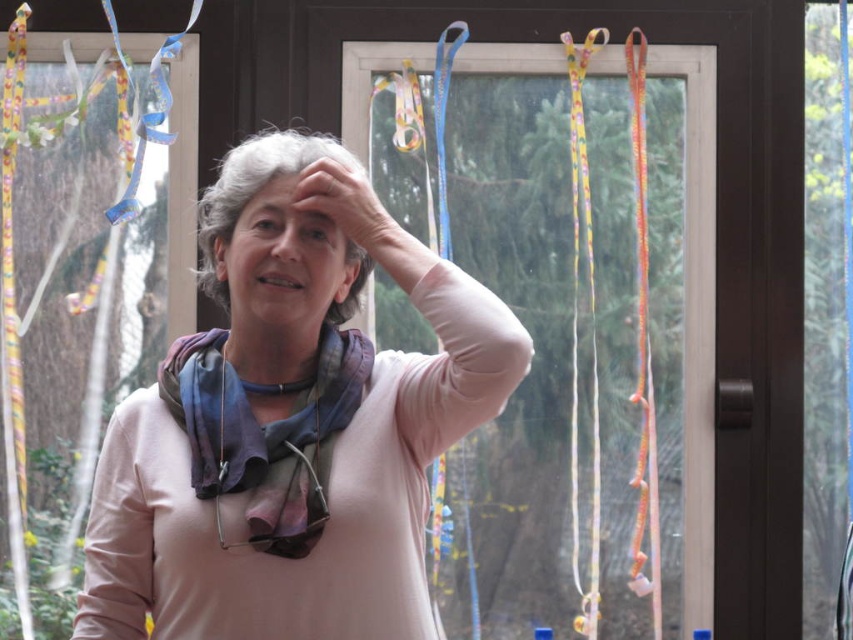
Between point (704, 388) and point (297, 141), which one is positioned behind?

Positioned behind is point (704, 388).

Between point (697, 563) and point (251, 156), which one is positioned behind?

The point (697, 563) is behind.

Locate an element on the screen. This screenshot has height=640, width=853. transparent plastic ribbons at upper center is located at coordinates (695, 316).

Between pink fabric scarf at center and smooth skin at center, which one is positioned higher?

smooth skin at center is higher up.

Can you confirm if pink fabric scarf at center is positioned to the left of smooth skin at center?

Incorrect, pink fabric scarf at center is not on the left side of smooth skin at center.

Who is more forward, (317,348) or (256,204)?

Positioned in front is point (256,204).

This screenshot has width=853, height=640. Identify the location of pink fabric scarf at center. (289, 433).

Is multicolored silk scarf at center shorter than smooth skin at center?

No.

Is point (276, 424) positioned after point (256, 189)?

No, (276, 424) is closer to viewer.

Is point (277, 435) positioned in front of point (300, 170)?

Yes, point (277, 435) is closer to viewer.

Find the location of `multicolored silk scarf at center`. multicolored silk scarf at center is located at coordinates (264, 435).